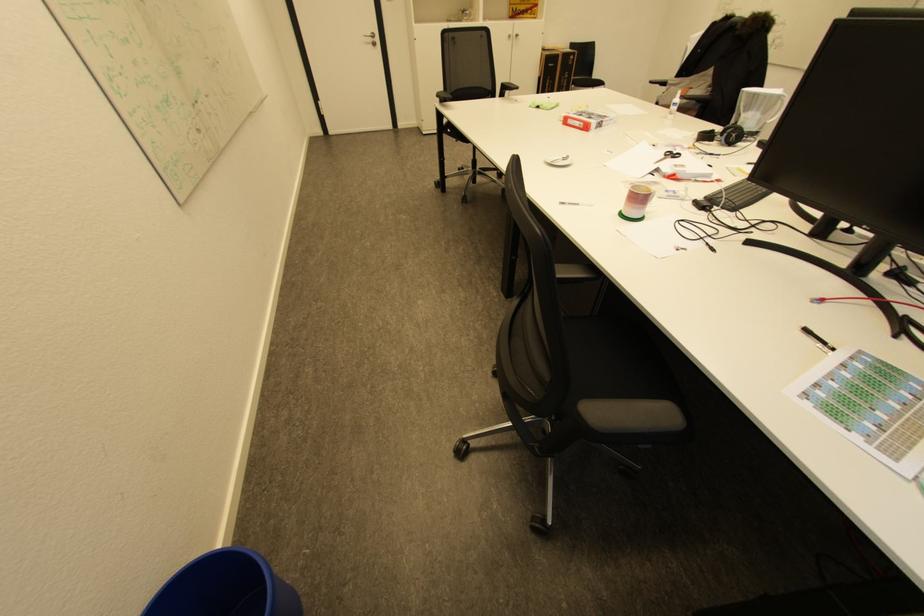
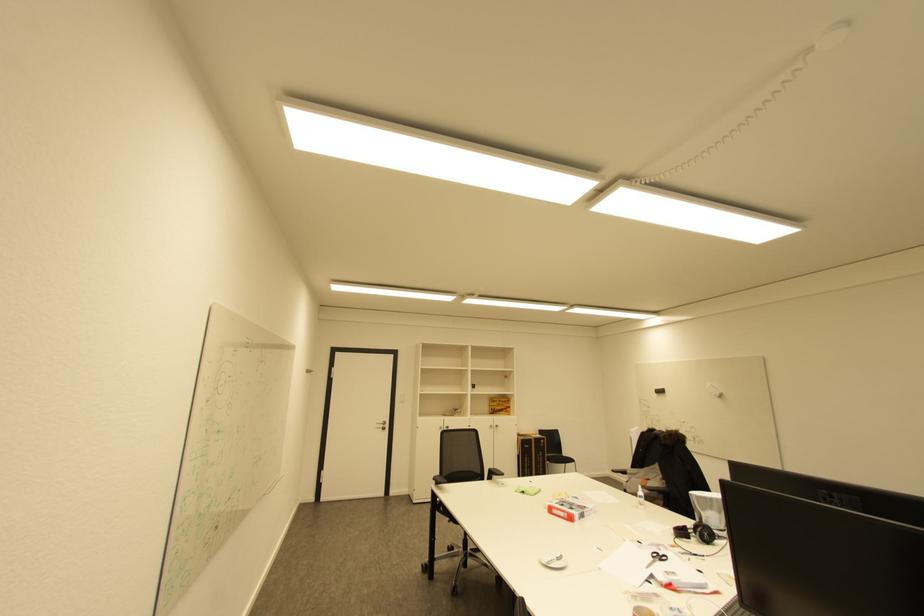
Locate, in the second image, the point that corresponds to point (672, 156) in the first image.

(659, 557)